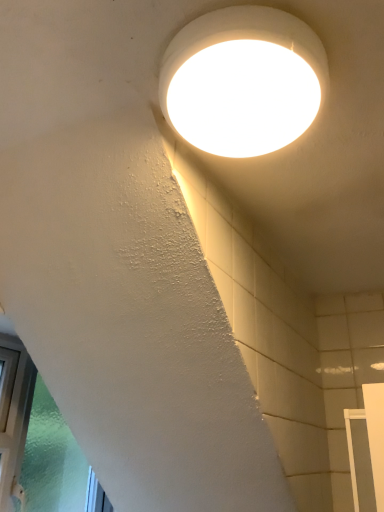
The image size is (384, 512). Describe the element at coordinates (243, 81) in the screenshot. I see `white glossy light fixture at upper center` at that location.

Find the location of a particular element. This screenshot has width=384, height=512. white glossy light fixture at upper center is located at coordinates (243, 81).

This screenshot has width=384, height=512. Describe the element at coordinates (37, 444) in the screenshot. I see `green frosted glass at lower left` at that location.

You are a GUI agent. You are given a task and a screenshot of the screen. Output one action in this format:
    pyautogui.click(x=<x>, y=<y>)
    Task: Click on the green frosted glass at lower left
    Image resolution: width=384 pixels, height=512 pixels.
    Given the screenshot: What is the action you would take?
    pyautogui.click(x=37, y=444)

Locate an element on the screen. The height and width of the screenshot is (512, 384). white glossy light fixture at upper center is located at coordinates (243, 81).

Does green frosted glass at lower left appear on the left side of white glossy light fixture at upper center?

Yes, green frosted glass at lower left is to the left of white glossy light fixture at upper center.

Which object is more forward, green frosted glass at lower left or white glossy light fixture at upper center?

→ white glossy light fixture at upper center is closer to the camera.

Is point (51, 493) closer or farther from the camera than point (255, 135)?

Clearly, point (51, 493) is more distant from the camera than point (255, 135).

From the image's perspective, is green frosted glass at lower left over white glossy light fixture at upper center?

No, from the image's perspective, green frosted glass at lower left is not over white glossy light fixture at upper center.

From a real-world perspective, is green frosted glass at lower left on top of white glossy light fixture at upper center?

Incorrect, from a real-world perspective, green frosted glass at lower left is lower than white glossy light fixture at upper center.

Between green frosted glass at lower left and white glossy light fixture at upper center, which one has smaller width?

Thinner between the two is green frosted glass at lower left.

From their relative heights in the image, would you say green frosted glass at lower left is taller or shorter than white glossy light fixture at upper center?

green frosted glass at lower left is taller than white glossy light fixture at upper center.

Which of these two, green frosted glass at lower left or white glossy light fixture at upper center, is smaller?

white glossy light fixture at upper center is smaller.

In the scene shown: Is green frosted glass at lower left not within white glossy light fixture at upper center?

Absolutely, green frosted glass at lower left is external to white glossy light fixture at upper center.

Consider the image. Is green frosted glass at lower left not close to white glossy light fixture at upper center?

That's right, there is a large distance between green frosted glass at lower left and white glossy light fixture at upper center.

Is green frosted glass at lower left oriented towards white glossy light fixture at upper center?

Yes, green frosted glass at lower left is aimed at white glossy light fixture at upper center.

How many degrees apart are the facing directions of green frosted glass at lower left and white glossy light fixture at upper center?

0.454 degrees separate the facing orientations of green frosted glass at lower left and white glossy light fixture at upper center.

In order to click on window on the left side of white glossy light fixture at upper center in this screenshot , I will do `click(37, 444)`.

Considering the relative positions of white glossy light fixture at upper center and green frosted glass at lower left in the image provided, is white glossy light fixture at upper center to the left of green frosted glass at lower left from the viewer's perspective?

No, white glossy light fixture at upper center is not to the left of green frosted glass at lower left.

From the picture: Is the position of white glossy light fixture at upper center more distant than that of green frosted glass at lower left?

That is False.

Which point is more forward, (x=249, y=91) or (x=55, y=501)?

The point (x=249, y=91) is more forward.

From the image's perspective, is white glossy light fixture at upper center over green frosted glass at lower left?

Yes, from the image's perspective, white glossy light fixture at upper center is on top of green frosted glass at lower left.

From a real-world perspective, is white glossy light fixture at upper center under green frosted glass at lower left?

Incorrect, from a real-world perspective, white glossy light fixture at upper center is higher than green frosted glass at lower left.

Considering the sizes of objects white glossy light fixture at upper center and green frosted glass at lower left in the image provided, who is thinner, white glossy light fixture at upper center or green frosted glass at lower left?

With smaller width is green frosted glass at lower left.

Who is shorter, white glossy light fixture at upper center or green frosted glass at lower left?

Standing shorter between the two is white glossy light fixture at upper center.

Considering the relative sizes of white glossy light fixture at upper center and green frosted glass at lower left in the image provided, is white glossy light fixture at upper center smaller than green frosted glass at lower left?

Correct, white glossy light fixture at upper center occupies less space than green frosted glass at lower left.

Is white glossy light fixture at upper center spatially inside green frosted glass at lower left, or outside of it?

white glossy light fixture at upper center exists outside the volume of green frosted glass at lower left.

Is white glossy light fixture at upper center next to green frosted glass at lower left?

They are not placed beside each other.

Could you tell me if white glossy light fixture at upper center is facing green frosted glass at lower left?

No.

What's the angular difference between white glossy light fixture at upper center and green frosted glass at lower left's facing directions?

There is a 0.454-degree angle between the facing directions of white glossy light fixture at upper center and green frosted glass at lower left.

What are the coordinates of `lamp located in front of the green frosted glass at lower left` in the screenshot? It's located at (243, 81).

Locate an element on the screen. The height and width of the screenshot is (512, 384). window below the white glossy light fixture at upper center (from the image's perspective) is located at coordinates (37, 444).

You are a GUI agent. You are given a task and a screenshot of the screen. Output one action in this format:
    pyautogui.click(x=<x>, y=<y>)
    Task: Click on the window below the white glossy light fixture at upper center (from a real-world perspective)
    This screenshot has width=384, height=512.
    Given the screenshot: What is the action you would take?
    pyautogui.click(x=37, y=444)